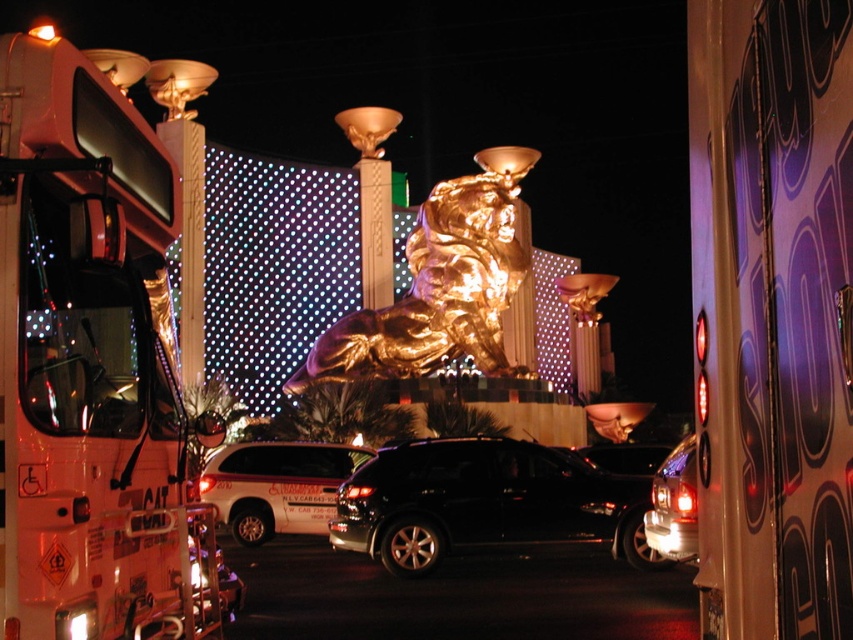
You are standing at the viewpoint of the image. There is a point marked at coordinates (154, 195). Can you safely walk to that point without moving more than 140 feet from your current position?

The point at (154, 195) is exactly 139.98 feet away from the viewer, so yes, you can safely walk to that point without exceeding the 140 feet limit.

You are a delivery driver trying to navigate through the area shown in the image. There is a white glossy fire truck at left. Can you safely pass around it without blocking the road?

The white glossy fire truck at left is located at point (x=93, y=369), which means it is positioned near the left edge of the frame. Since it is a fire truck, you should proceed with caution and look for a safe path around it while ensuring not to obstruct traffic flow. However, without knowing the exact road layout or available space, it is recommended to follow local traffic rules and seek alternative routes if necessary.